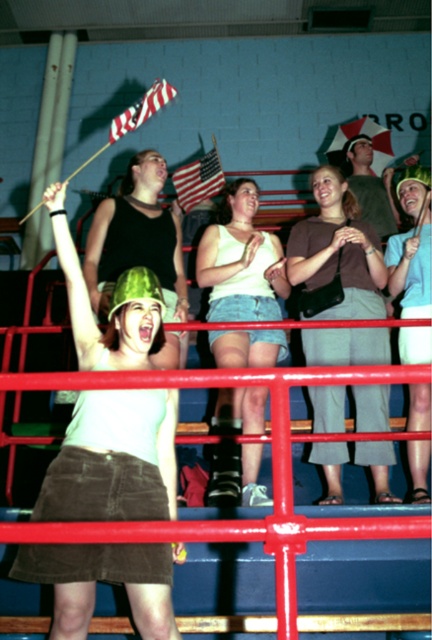
Question: Considering the real-world distances, which object is farthest from the brown fabric pants at center?

Choices:
 (A) denim shorts at center
 (B) american flag at upper center
 (C) striped fabric flag at upper left
 (D) matte green helmet at center

Answer: (B)

Question: Is brown fabric pants at center bigger than denim shorts at center?

Choices:
 (A) no
 (B) yes

Answer: (A)

Question: Which point is closer to the camera taking this photo?

Choices:
 (A) (69, 566)
 (B) (245, 460)
 (C) (406, 340)
 (D) (216, 163)

Answer: (A)

Question: Among these points, which one is nearest to the camera?

Choices:
 (A) (72, 484)
 (B) (174, 333)
 (C) (215, 316)
 (D) (143, 116)

Answer: (A)

Question: Is matte green helmet at center further to camera compared to denim shorts at center?

Choices:
 (A) no
 (B) yes

Answer: (A)

Question: Does denim shorts at center have a lesser width compared to striped fabric flag at upper left?

Choices:
 (A) no
 (B) yes

Answer: (A)